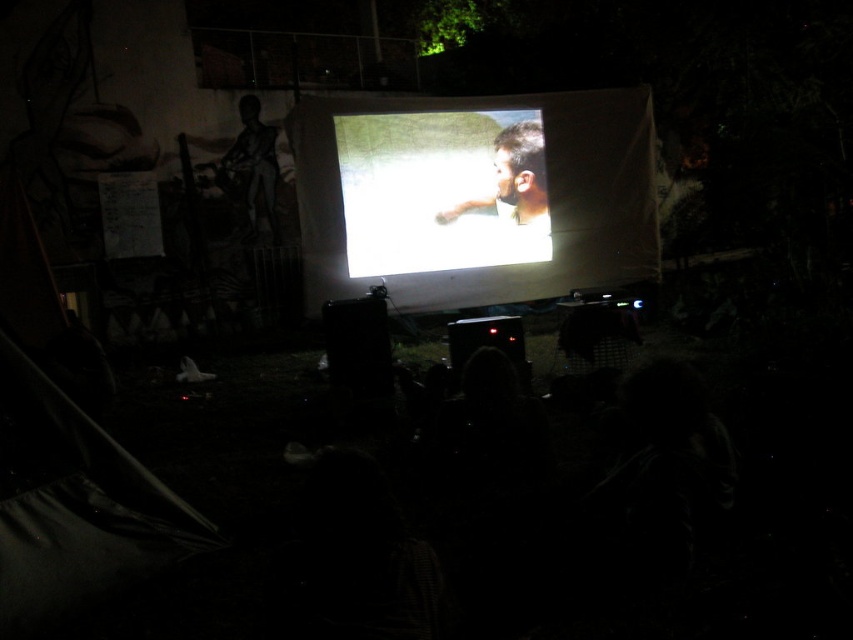
Question: Is bright white screen at center further to the viewer compared to smooth skin face at center?

Choices:
 (A) yes
 (B) no

Answer: (B)

Question: Among these points, which one is nearest to the camera?

Choices:
 (A) (421, 250)
 (B) (467, 204)

Answer: (A)

Question: Is bright white screen at center to the right of smooth skin face at center from the viewer's perspective?

Choices:
 (A) no
 (B) yes

Answer: (A)

Question: Among these points, which one is nearest to the camera?

Choices:
 (A) (415, 176)
 (B) (498, 179)

Answer: (A)

Question: Does bright white screen at center appear over smooth skin face at center?

Choices:
 (A) no
 (B) yes

Answer: (A)